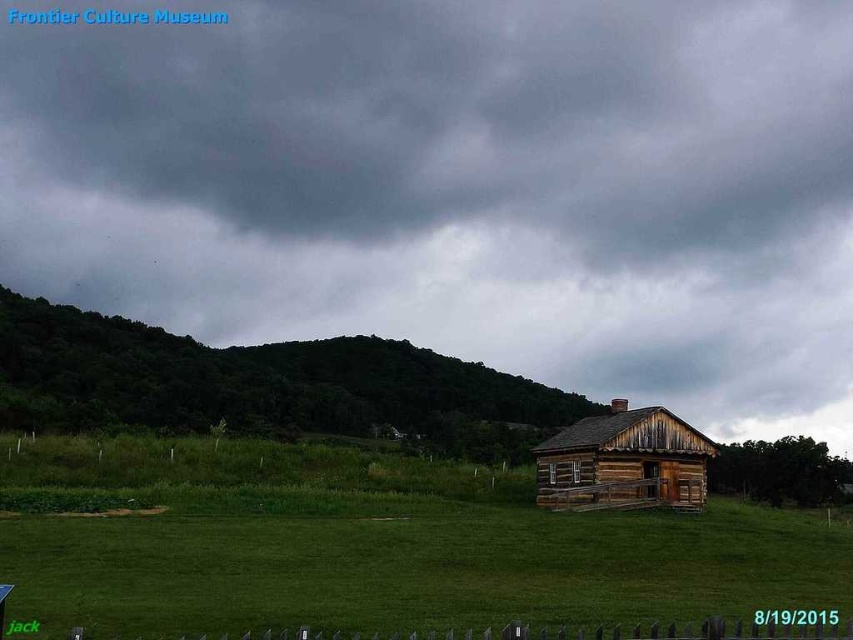
You are standing in front of the cabin and want to take a photo. There are two points marked on your camera screen at coordinates point [358,426] and point [428,637]. Which point is closer to you?

Point [428,637] is closer to you because it is less further to the camera than point [358,426].

You are standing in front of the rustic wooden cabin and notice a specific point in the image. What object is located at the coordinate point (250, 381)?

The green leafy hillside at upper left is located at point (250, 381).

You are a weather observer standing in the green grassy at lower center looking up. Which direction should you look to see the dark gray cloud at upper center?

The dark gray cloud at upper center is above the green grassy at lower center, so you should look upward to see it.